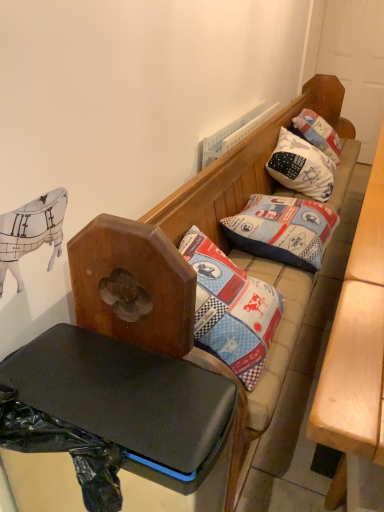
Question: Considering the relative sizes of black plastic table at lower left, which appears as the second table when viewed from the right, and white cotton pillow at upper right, marked as the 1th pillow in a back-to-front arrangement, in the image provided, is black plastic table at lower left, which appears as the second table when viewed from the right, wider than white cotton pillow at upper right, marked as the 1th pillow in a back-to-front arrangement,?

Choices:
 (A) yes
 (B) no

Answer: (B)

Question: From the image's perspective, does black plastic table at lower left, the first table positioned from the left, appear higher than white cotton pillow at upper right, marked as the 1th pillow in a back-to-front arrangement?

Choices:
 (A) no
 (B) yes

Answer: (A)

Question: Is black plastic table at lower left, which appears as the second table when viewed from the right, thinner than white cotton pillow at upper right, acting as the second pillow starting from the front?

Choices:
 (A) no
 (B) yes

Answer: (B)

Question: Does black plastic table at lower left, the first table positioned from the left, appear on the left side of white cotton pillow at upper right, acting as the second pillow starting from the front?

Choices:
 (A) no
 (B) yes

Answer: (B)

Question: Does black plastic table at lower left, which appears as the second table when viewed from the right, lie in front of white cotton pillow at upper right, marked as the 1th pillow in a back-to-front arrangement?

Choices:
 (A) no
 (B) yes

Answer: (B)

Question: Is black plastic table at lower left, which appears as the second table when viewed from the right, facing towards white cotton pillow at upper right, marked as the 1th pillow in a back-to-front arrangement?

Choices:
 (A) no
 (B) yes

Answer: (A)

Question: Can you confirm if black plastic table at lower left, which appears as the second table when viewed from the right, is taller than light brown wooden table at right, the 2th table positioned from the left?

Choices:
 (A) yes
 (B) no

Answer: (B)

Question: From a real-world perspective, is black plastic table at lower left, the first table positioned from the left, beneath light brown wooden table at right, the 2th table positioned from the left?

Choices:
 (A) no
 (B) yes

Answer: (B)

Question: Can you confirm if black plastic table at lower left, which appears as the second table when viewed from the right, is shorter than light brown wooden table at right, the 1th table from the right?

Choices:
 (A) no
 (B) yes

Answer: (B)

Question: Could you tell me if black plastic table at lower left, the first table positioned from the left, is turned towards light brown wooden table at right, the 2th table positioned from the left?

Choices:
 (A) yes
 (B) no

Answer: (B)

Question: Is black plastic table at lower left, which appears as the second table when viewed from the right, behind light brown wooden table at right, the 2th table positioned from the left?

Choices:
 (A) no
 (B) yes

Answer: (B)

Question: Considering the relative sizes of black plastic table at lower left, the first table positioned from the left, and light brown wooden table at right, the 2th table positioned from the left, in the image provided, is black plastic table at lower left, the first table positioned from the left, smaller than light brown wooden table at right, the 2th table positioned from the left,?

Choices:
 (A) no
 (B) yes

Answer: (B)

Question: Is black plastic table at lower left, the first table positioned from the left, oriented away from patchwork fabric pillow at center, arranged as the 2th pillow when viewed from the back?

Choices:
 (A) no
 (B) yes

Answer: (B)